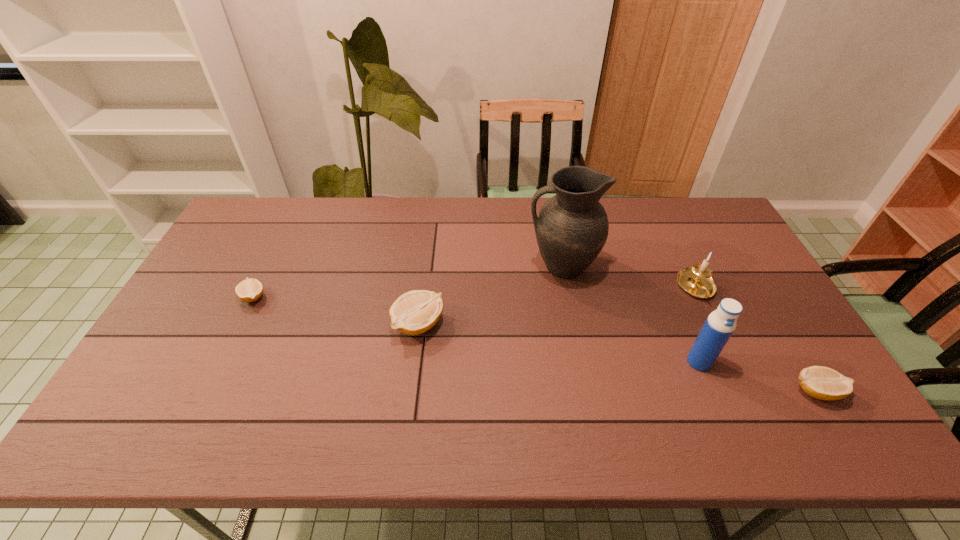
Locate an element on the screen. the leftmost lemon is located at coordinates (249, 290).

Where is `the leftmost object`? This screenshot has width=960, height=540. the leftmost object is located at coordinates (249, 290).

The width and height of the screenshot is (960, 540). In order to click on the second lemon from right to left in this screenshot , I will do [x=415, y=312].

Identify the location of the tallest lemon. The width and height of the screenshot is (960, 540). (415, 312).

The height and width of the screenshot is (540, 960). I want to click on the rightmost lemon, so click(x=823, y=383).

Locate an element on the screen. The height and width of the screenshot is (540, 960). the nearest object is located at coordinates (823, 383).

The width and height of the screenshot is (960, 540). I want to click on the tallest object, so click(x=571, y=229).

Where is `the third object from left to right`? The height and width of the screenshot is (540, 960). the third object from left to right is located at coordinates (571, 229).

The image size is (960, 540). I want to click on candle holder, so click(696, 280).

You are a GUI agent. You are given a task and a screenshot of the screen. Output one action in this format:
    pyautogui.click(x=<x>, y=<y>)
    Task: Click on the third tallest object
    The image size is (960, 540).
    Given the screenshot: What is the action you would take?
    pyautogui.click(x=696, y=280)